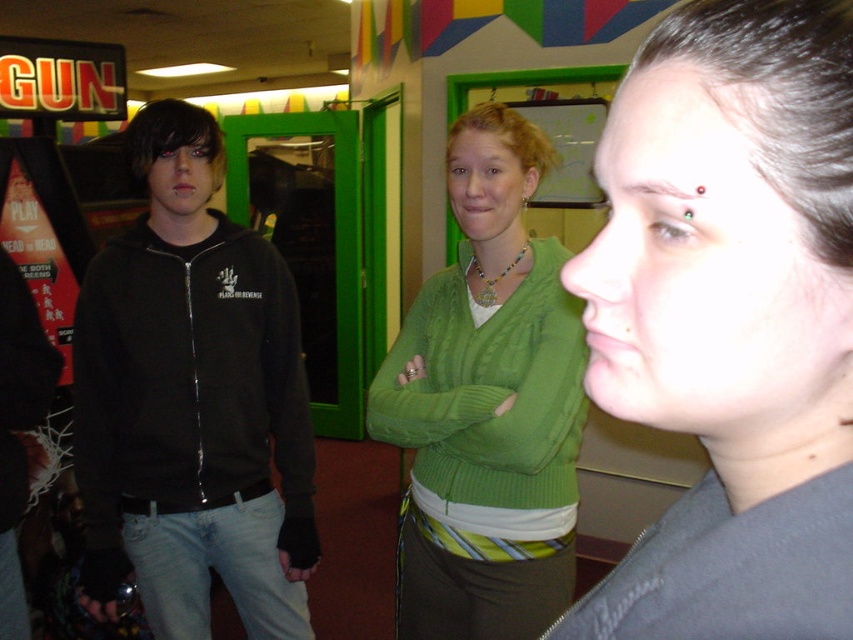
Question: Does black zip-up hoodie at left appear over green knitted sweater at center?

Choices:
 (A) yes
 (B) no

Answer: (B)

Question: Is black zip-up hoodie at left positioned behind green knitted sweater at center?

Choices:
 (A) no
 (B) yes

Answer: (B)

Question: Which object is closer to the camera taking this photo?

Choices:
 (A) matte black forehead at upper center
 (B) black zip-up hoodie at left

Answer: (A)

Question: Which of the following is the closest to the observer?

Choices:
 (A) (751, 570)
 (B) (172, 276)
 (C) (549, 456)

Answer: (A)

Question: Does matte black forehead at upper center have a lesser width compared to green knitted sweater at center?

Choices:
 (A) yes
 (B) no

Answer: (A)

Question: Which of the following is the closest to the observer?

Choices:
 (A) green knitted sweater at center
 (B) matte black forehead at upper center

Answer: (B)